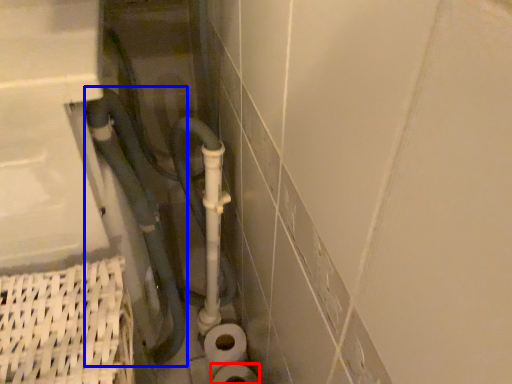
Question: Which point is closer to the camera, toilet paper (highlighted by a red box) or water pipe (highlighted by a blue box)?

Choices:
 (A) toilet paper
 (B) water pipe

Answer: (B)